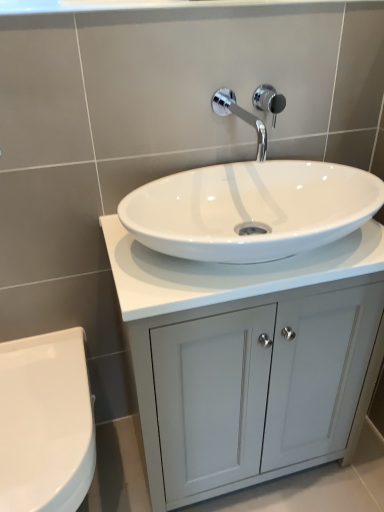
Question: Is white glossy toilet at lower left outside of chrome metallic shower at upper center?

Choices:
 (A) yes
 (B) no

Answer: (A)

Question: Does white glossy toilet at lower left have a larger size compared to chrome metallic shower at upper center?

Choices:
 (A) yes
 (B) no

Answer: (A)

Question: Does white glossy toilet at lower left lie behind chrome metallic shower at upper center?

Choices:
 (A) no
 (B) yes

Answer: (A)

Question: Can you confirm if white glossy toilet at lower left is taller than chrome metallic shower at upper center?

Choices:
 (A) yes
 (B) no

Answer: (A)

Question: Is white glossy toilet at lower left not close to chrome metallic shower at upper center?

Choices:
 (A) no
 (B) yes

Answer: (A)

Question: Does white glossy toilet at lower left have a lesser width compared to chrome metallic shower at upper center?

Choices:
 (A) yes
 (B) no

Answer: (B)

Question: From a real-world perspective, is white glossy cabinet at center under chrome metallic shower at upper center?

Choices:
 (A) yes
 (B) no

Answer: (A)

Question: Is white glossy cabinet at center further to the viewer compared to chrome metallic shower at upper center?

Choices:
 (A) no
 (B) yes

Answer: (A)

Question: Does white glossy cabinet at center touch chrome metallic shower at upper center?

Choices:
 (A) no
 (B) yes

Answer: (A)

Question: From a real-world perspective, does white glossy cabinet at center stand above chrome metallic shower at upper center?

Choices:
 (A) yes
 (B) no

Answer: (B)

Question: From the image's perspective, is white glossy cabinet at center under chrome metallic shower at upper center?

Choices:
 (A) no
 (B) yes

Answer: (B)

Question: Can you confirm if white glossy cabinet at center is shorter than chrome metallic shower at upper center?

Choices:
 (A) no
 (B) yes

Answer: (A)

Question: From the image's perspective, is chrome metallic faucet at upper center below white glossy countertop at center?

Choices:
 (A) no
 (B) yes

Answer: (A)